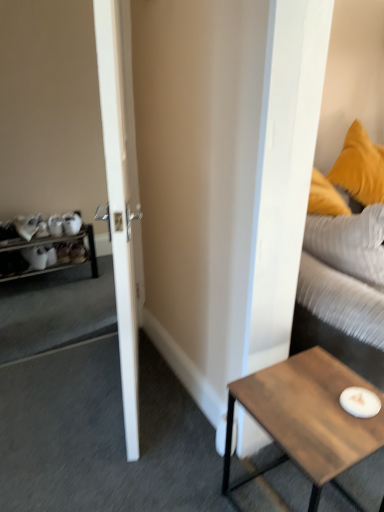
Question: Does point pos(124,58) appear closer or farther from the camera than point pos(1,250)?

Choices:
 (A) farther
 (B) closer

Answer: (B)

Question: Would you say white glossy door at left is inside or outside wooden shelf at left?

Choices:
 (A) inside
 (B) outside

Answer: (B)

Question: Which object is the farthest from the wooden shelf at left?

Choices:
 (A) wooden coffee table at lower right
 (B) velvet yellow pillow at upper right
 (C) white glossy door at left

Answer: (A)

Question: Estimate the real-world distances between objects in this image. Which object is farther from the velvet yellow pillow at upper right?

Choices:
 (A) wooden coffee table at lower right
 (B) wooden shelf at left
 (C) white glossy door at left

Answer: (B)